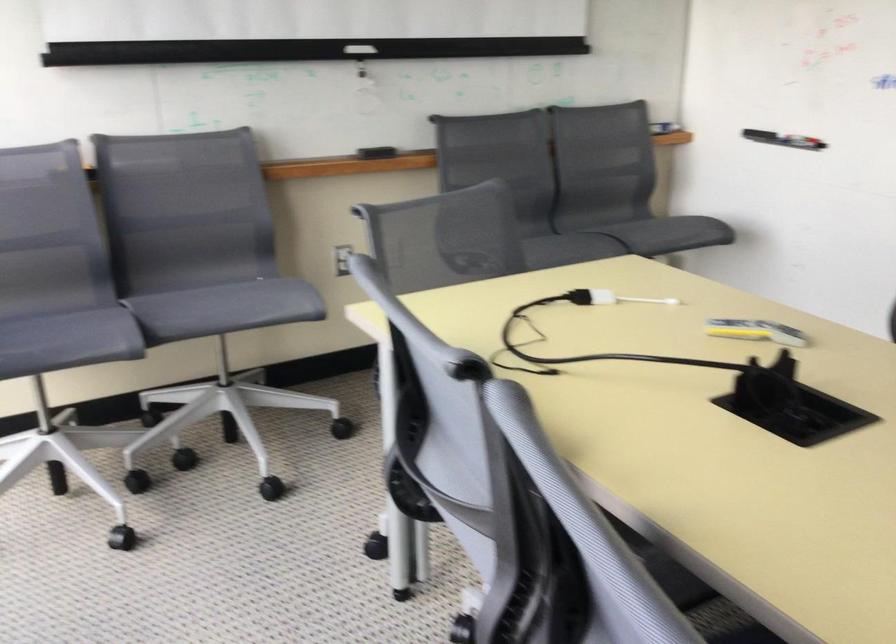
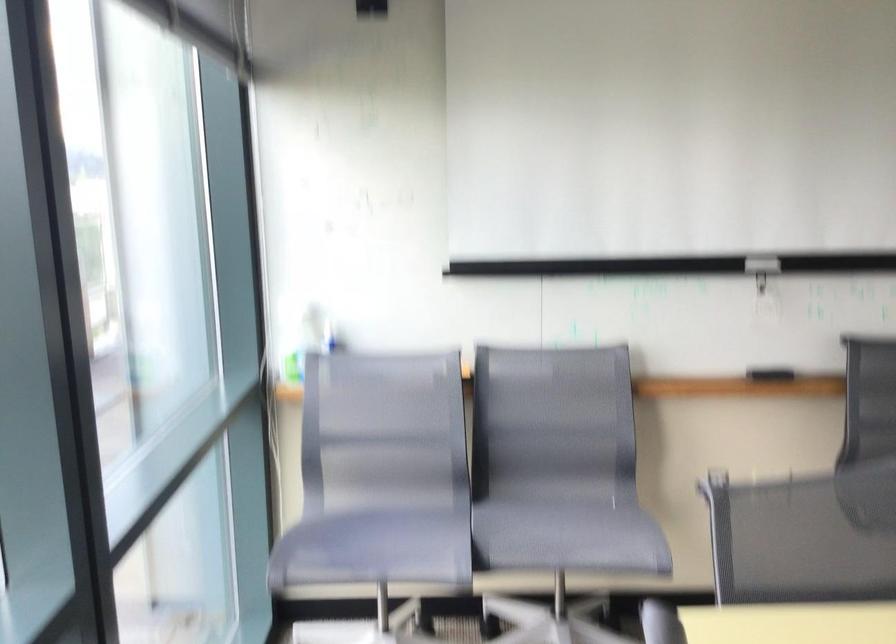
Question: How did the camera likely rotate?

Choices:
 (A) Left
 (B) Right
 (C) Up
 (D) Down

Answer: (A)